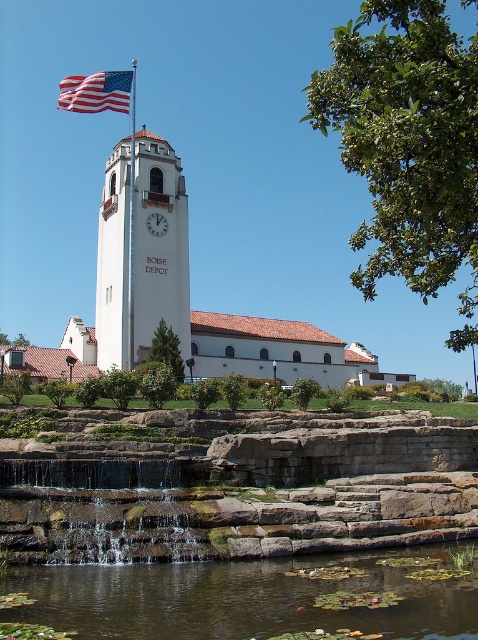
Is point (109, 596) positioned behind point (152, 212)?

No, (109, 596) is closer to viewer.

Is transparent water at lower center in front of white matte clock at center?

Yes, transparent water at lower center is in front of white matte clock at center.

Between point (101, 576) and point (150, 221), which one is positioned in front?

Point (101, 576) is more forward.

I want to click on transparent water at lower center, so click(x=257, y=596).

Does transparent water at lower center appear on the left side of white smooth clock tower at center?

In fact, transparent water at lower center is to the right of white smooth clock tower at center.

Does transparent water at lower center have a lesser height compared to white smooth clock tower at center?

Yes.

Between point (263, 630) and point (155, 148), which one is positioned behind?

Point (155, 148)

At what (x,y) coordinates should I click in order to perform the action: click on transparent water at lower center. Please return your answer as a coordinate pair (x, y). The height and width of the screenshot is (640, 478). Looking at the image, I should click on (257, 596).

Does metallic flagpole at upper left have a smaller size compared to white matte clock at center?

No.

Can you confirm if metallic flagpole at upper left is positioned above white matte clock at center?

Yes, metallic flagpole at upper left is above white matte clock at center.

Measure the distance between metallic flagpole at upper left and camera.

They are 91.96 meters apart.

At what (x,y) coordinates should I click in order to perform the action: click on metallic flagpole at upper left. Please return your answer as a coordinate pair (x, y). Looking at the image, I should click on (131, 220).